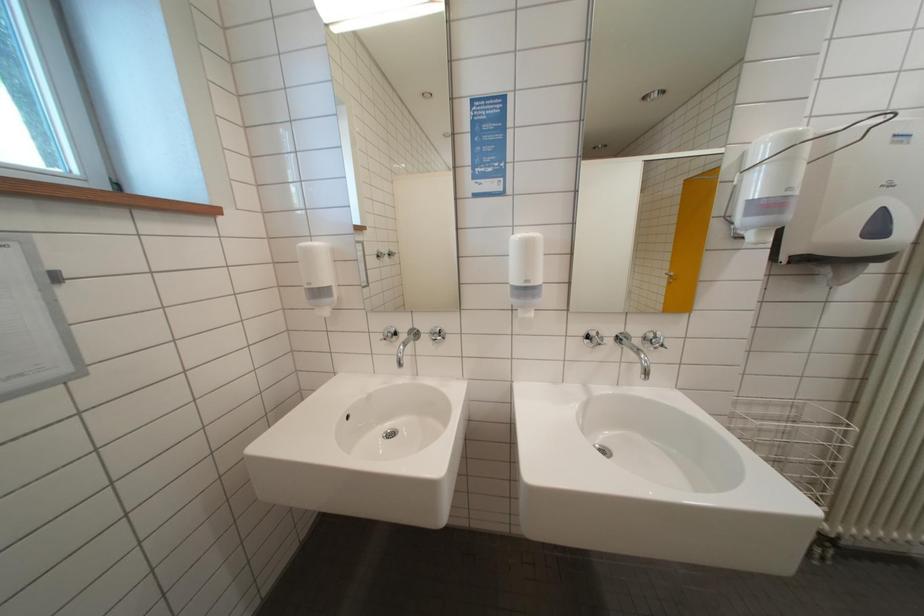
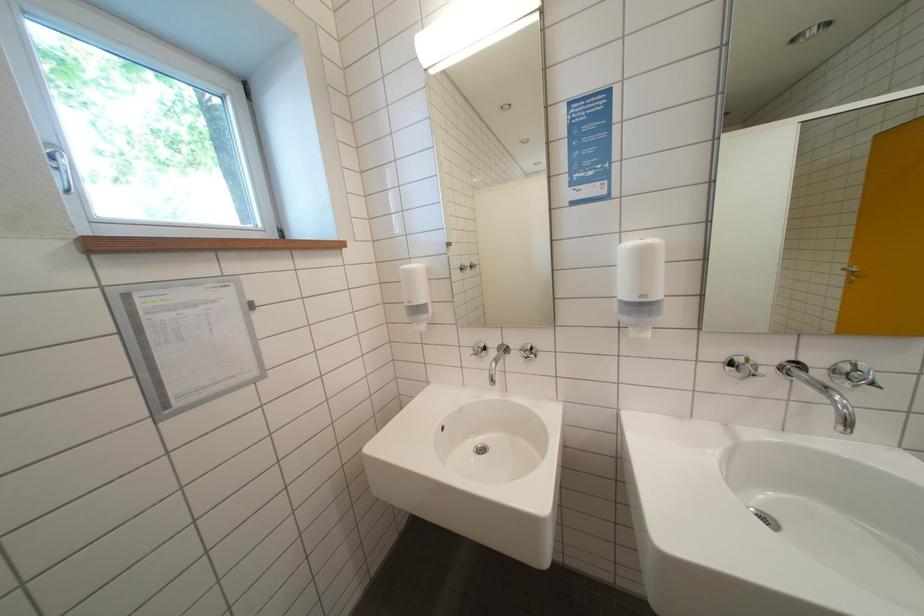
Question: How did the camera likely rotate?

Choices:
 (A) Left
 (B) Right
 (C) Up
 (D) Down

Answer: (A)